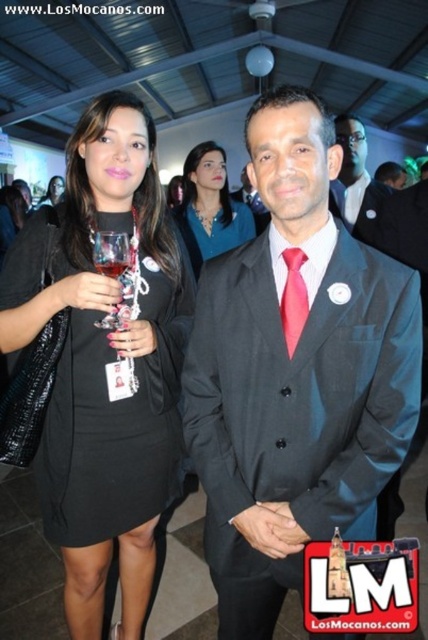
From the picture: You are at the event and want to take a photo of both the black matte dress at center and the transparent glass at center. Which one should you focus on first to ensure both are in the frame?

You should focus on the black matte dress at center first because it is to the left of the transparent glass at center, so positioning the camera to include both from left to right would start with the dress.

You are a photographer at this event and need to capture a photo of both the black satin suit at center and the transparent glass at center without any obstruction. Considering their positions, which object is more likely to block the other when framing the shot?

The black satin suit at center might be wider than transparent glass at center, so it could potentially block the view of the transparent glass at center if positioned in front.

You are at a networking event and see two people at the center of the scene. The woman is wearing a black matte dress at center and the man is wearing a red satin tie at center. Which person is positioned to the left?

The black matte dress at center is to the left of the red satin tie at center, so the woman in the black matte dress at center is positioned to the left.